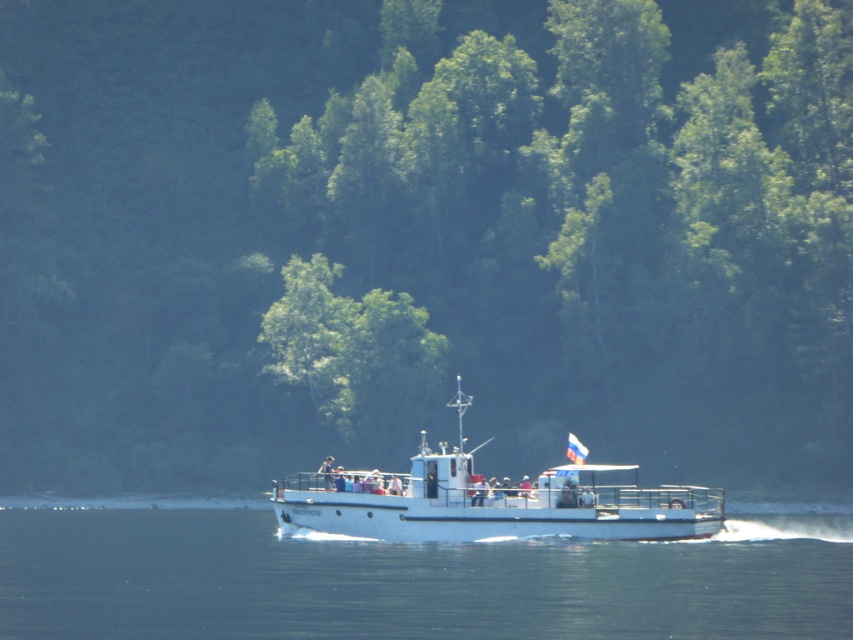
Question: Can you confirm if clear blue water at center is positioned to the right of green leafy tree at center?

Choices:
 (A) yes
 (B) no

Answer: (A)

Question: Does clear blue water at center have a greater width compared to white matte boat at center?

Choices:
 (A) yes
 (B) no

Answer: (A)

Question: Among these points, which one is nearest to the camera?

Choices:
 (A) (708, 492)
 (B) (550, 582)
 (C) (390, 352)

Answer: (B)

Question: Which of the following is the farthest from the observer?

Choices:
 (A) (422, 320)
 (B) (668, 605)

Answer: (A)

Question: Which point appears farthest from the camera in this image?

Choices:
 (A) [808, 596]
 (B) [387, 339]
 (C) [477, 531]

Answer: (B)

Question: Is white matte boat at center further to camera compared to green leafy tree at center?

Choices:
 (A) yes
 (B) no

Answer: (B)